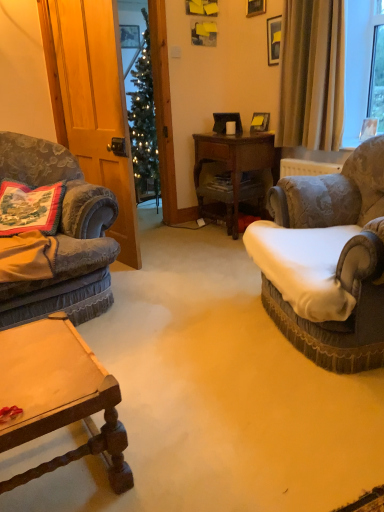
Describe the element at coordinates (333, 257) in the screenshot. Image resolution: width=384 pixels, height=512 pixels. I see `velvet-patterned armchair at right, arranged as the first chair when viewed from the right` at that location.

Image resolution: width=384 pixels, height=512 pixels. Describe the element at coordinates (62, 236) in the screenshot. I see `velvet fabric armchair at left, arranged as the second chair when viewed from the right` at that location.

This screenshot has height=512, width=384. Find the location of `wooden desk at center`. wooden desk at center is located at coordinates (234, 170).

At what (x,y) coordinates should I click in order to perform the action: click on wooden picture frame at upper center, which is the 1th picture frame from right to left. Please return your answer as a coordinate pair (x, y). Looking at the image, I should click on (255, 7).

In order to face matte white mug at center, should I rotate leftwards or rightwards?

Turn right approximately 5.229 degrees to face it.

What is the approximate width of metallic gold picture frame at upper center, placed as the second picture frame when sorted from front to back?

metallic gold picture frame at upper center, placed as the second picture frame when sorted from front to back, is 1.42 inches in width.

You are a GUI agent. You are given a task and a screenshot of the screen. Output one action in this format:
    pyautogui.click(x=<x>, y=<y>)
    Task: Click on the metallic gold picture frame at upper center, which is counted as the second picture frame, starting from the right
    This screenshot has height=512, width=384.
    Given the screenshot: What is the action you would take?
    pyautogui.click(x=129, y=36)

At what (x,y) coordinates should I click in order to perform the action: click on velvet-patterned armchair at right, which is the second chair from left to right. Please return your answer as a coordinate pair (x, y). The height and width of the screenshot is (512, 384). Looking at the image, I should click on (333, 257).

Between point (120, 24) and point (230, 126), which one is positioned behind?

The point (120, 24) is behind.

From the image's perspective, is metallic gold picture frame at upper center, which is counted as the second picture frame, starting from the right, over matte white mug at center?

Yes, from the image's perspective, metallic gold picture frame at upper center, which is counted as the second picture frame, starting from the right, is above matte white mug at center.

Is metallic gold picture frame at upper center, placed as the second picture frame when sorted from front to back, facing towards matte white mug at center?

No, metallic gold picture frame at upper center, placed as the second picture frame when sorted from front to back, is not turned towards matte white mug at center.

Is metallic gold picture frame at upper center, the 1th picture frame viewed from the back, smaller than matte white mug at center?

No, metallic gold picture frame at upper center, the 1th picture frame viewed from the back, is not smaller than matte white mug at center.

Considering the relative positions of velvet fabric armchair at left, arranged as the second chair when viewed from the right, and metallic gold picture frame at upper center, placed as the second picture frame when sorted from front to back, in the image provided, is velvet fabric armchair at left, arranged as the second chair when viewed from the right, to the left of metallic gold picture frame at upper center, placed as the second picture frame when sorted from front to back, from the viewer's perspective?

Yes, velvet fabric armchair at left, arranged as the second chair when viewed from the right, is to the left of metallic gold picture frame at upper center, placed as the second picture frame when sorted from front to back.

Based on the photo, from a real-world perspective, is velvet fabric armchair at left, arranged as the second chair when viewed from the right, positioned under metallic gold picture frame at upper center, the 1th picture frame from the left, based on gravity?

Yes, from a real-world perspective, velvet fabric armchair at left, arranged as the second chair when viewed from the right, is beneath metallic gold picture frame at upper center, the 1th picture frame from the left.

Would you say velvet fabric armchair at left, which is counted as the 1th chair, starting from the left, is outside metallic gold picture frame at upper center, which is counted as the second picture frame, starting from the right?

velvet fabric armchair at left, which is counted as the 1th chair, starting from the left, is positioned outside metallic gold picture frame at upper center, which is counted as the second picture frame, starting from the right.

From the image's perspective, which is above, velvet fabric armchair at left, arranged as the second chair when viewed from the right, or metallic gold picture frame at upper center, placed as the second picture frame when sorted from front to back?

metallic gold picture frame at upper center, placed as the second picture frame when sorted from front to back.

Which is more to the right, metallic gold picture frame at upper center, which is counted as the second picture frame, starting from the right, or beige fabric curtain at upper right?

From the viewer's perspective, beige fabric curtain at upper right appears more on the right side.

In terms of width, does metallic gold picture frame at upper center, placed as the second picture frame when sorted from front to back, look wider or thinner when compared to beige fabric curtain at upper right?

Considering their sizes, metallic gold picture frame at upper center, placed as the second picture frame when sorted from front to back, looks slimmer than beige fabric curtain at upper right.

Considering their positions, is metallic gold picture frame at upper center, the 1th picture frame from the left, located in front of or behind beige fabric curtain at upper right?

In the image, metallic gold picture frame at upper center, the 1th picture frame from the left, appears behind beige fabric curtain at upper right.

Considering the relative positions of matte white mug at center and velvet-patterned armchair at right, which is the second chair from left to right, in the image provided, is matte white mug at center to the left of velvet-patterned armchair at right, which is the second chair from left to right, from the viewer's perspective?

Correct, you'll find matte white mug at center to the left of velvet-patterned armchair at right, which is the second chair from left to right.

Is matte white mug at center positioned with its back to velvet-patterned armchair at right, which is the second chair from left to right?

No, matte white mug at center is not facing away from velvet-patterned armchair at right, which is the second chair from left to right.

From a real-world perspective, is matte white mug at center physically above velvet-patterned armchair at right, arranged as the first chair when viewed from the right?

Yes, from a real-world perspective, matte white mug at center is above velvet-patterned armchair at right, arranged as the first chair when viewed from the right.

Are matte white mug at center and velvet-patterned armchair at right, arranged as the first chair when viewed from the right, far apart?

matte white mug at center is positioned a significant distance from velvet-patterned armchair at right, arranged as the first chair when viewed from the right.

Would you consider wooden desk at center to be distant from beige fabric curtain at upper right?

No, wooden desk at center is not far from beige fabric curtain at upper right.

Is wooden desk at center bigger or smaller than beige fabric curtain at upper right?

In the image, wooden desk at center appears to be larger than beige fabric curtain at upper right.

What are the coordinates of `curtain in front of the matte white mug at center` in the screenshot? It's located at (312, 75).

Are beige fabric curtain at upper right and matte white mug at center far apart?

That's not correct — beige fabric curtain at upper right is a little close to matte white mug at center.

Which is closer to the camera, [333,84] or [232,125]?

The point [333,84] is closer.

In terms of size, does beige fabric curtain at upper right appear bigger or smaller than matte white mug at center?

Considering their sizes, beige fabric curtain at upper right takes up more space than matte white mug at center.

Is velvet fabric armchair at left, which is counted as the 1th chair, starting from the left, shorter than matte white mug at center?

No, velvet fabric armchair at left, which is counted as the 1th chair, starting from the left, is not shorter than matte white mug at center.

Considering the relative positions of velvet fabric armchair at left, arranged as the second chair when viewed from the right, and matte white mug at center in the image provided, is velvet fabric armchair at left, arranged as the second chair when viewed from the right, to the right of matte white mug at center from the viewer's perspective?

In fact, velvet fabric armchair at left, arranged as the second chair when viewed from the right, is to the left of matte white mug at center.

Is velvet fabric armchair at left, which is counted as the 1th chair, starting from the left, far from matte white mug at center?

Yes, velvet fabric armchair at left, which is counted as the 1th chair, starting from the left, and matte white mug at center are quite far apart.

The width and height of the screenshot is (384, 512). I want to click on the 1st picture frame directly above the matte white mug at center (from a real-world perspective), so click(129, 36).

This screenshot has width=384, height=512. What are the coordinates of `the 1st picture frame counting from the right of the velvet fabric armchair at left, which is counted as the 1th chair, starting from the left` in the screenshot? It's located at (129, 36).

Based on their spatial positions, is wooden desk at center or metallic gold picture frame at upper center, the 1th picture frame viewed from the back, further from beige fabric curtain at upper right?

metallic gold picture frame at upper center, the 1th picture frame viewed from the back.

Looking at the image, which one is located closer to beige fabric curtain at upper right, embroidered fabric pillow at left or wooden picture frame at upper center, which is the 1th picture frame from right to left?

wooden picture frame at upper center, which is the 1th picture frame from right to left, is closer to beige fabric curtain at upper right.

When comparing their distances from embroidered fabric pillow at left, does wooden picture frame at upper center, positioned as the second picture frame in left-to-right order, or matte white mug at center seem closer?

matte white mug at center is positioned closer to the anchor embroidered fabric pillow at left.

Based on their spatial positions, is embroidered fabric pillow at left or velvet fabric armchair at left, arranged as the second chair when viewed from the right, closer to wooden desk at center?

velvet fabric armchair at left, arranged as the second chair when viewed from the right, lies closer to wooden desk at center than the other object.

Based on their spatial positions, is beige fabric curtain at upper right or embroidered fabric pillow at left closer to metallic gold picture frame at upper center, the 1th picture frame from the left?

beige fabric curtain at upper right is closer to metallic gold picture frame at upper center, the 1th picture frame from the left.

From the image, which object appears to be nearer to metallic gold picture frame at upper center, the 1th picture frame from the left, wooden desk at center or beige fabric curtain at upper right?

The object closer to metallic gold picture frame at upper center, the 1th picture frame from the left, is wooden desk at center.

From the image, which object appears to be farther from velvet-patterned armchair at right, which is the second chair from left to right, metallic gold picture frame at upper center, which is counted as the second picture frame, starting from the right, or matte white mug at center?

metallic gold picture frame at upper center, which is counted as the second picture frame, starting from the right, lies further to velvet-patterned armchair at right, which is the second chair from left to right, than the other object.

Which object lies further to the anchor point velvet-patterned armchair at right, which is the second chair from left to right, embroidered fabric pillow at left or wooden picture frame at upper center, positioned as the second picture frame in left-to-right order?

wooden picture frame at upper center, positioned as the second picture frame in left-to-right order, is further to velvet-patterned armchair at right, which is the second chair from left to right.

Identify the location of desk positioned between velvet-patterned armchair at right, which is the second chair from left to right, and wooden picture frame at upper center, positioned as the second picture frame in left-to-right order, from near to far. (234, 170).

At what (x,y) coordinates should I click in order to perform the action: click on chair located between embroidered fabric pillow at left and beige fabric curtain at upper right in the left-right direction. Please return your answer as a coordinate pair (x, y). The image size is (384, 512). Looking at the image, I should click on (62, 236).

Identify the location of desk located between velvet-patterned armchair at right, which is the second chair from left to right, and metallic gold picture frame at upper center, placed as the second picture frame when sorted from front to back, in the depth direction. (234, 170).

I want to click on curtain between wooden picture frame at upper center, positioned as the second picture frame in left-to-right order, and wooden desk at center vertically, so click(x=312, y=75).